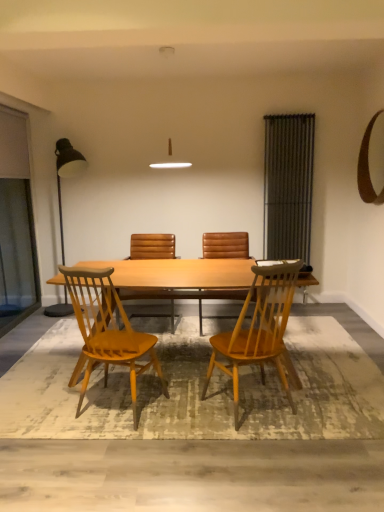
Find the location of a particular element. The image size is (384, 512). vacant space to the right of light brown wood chair at center, which is counted as the 4th chair, starting from the back is located at coordinates (328, 410).